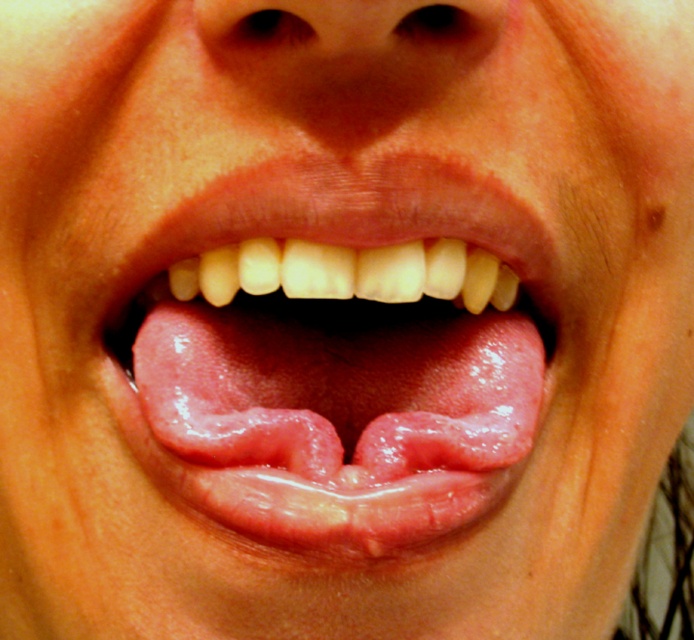
Between pink flesh tongue at center and smooth skin at center, which one is positioned lower?

Positioned lower is pink flesh tongue at center.

Between pink flesh tongue at center and smooth skin at center, which one appears on the left side from the viewer's perspective?

From the viewer's perspective, pink flesh tongue at center appears more on the left side.

Who is more forward, [296,160] or [319,38]?

Positioned in front is point [319,38].

Where is `pink flesh tongue at center`? Image resolution: width=694 pixels, height=640 pixels. pink flesh tongue at center is located at coordinates (335, 353).